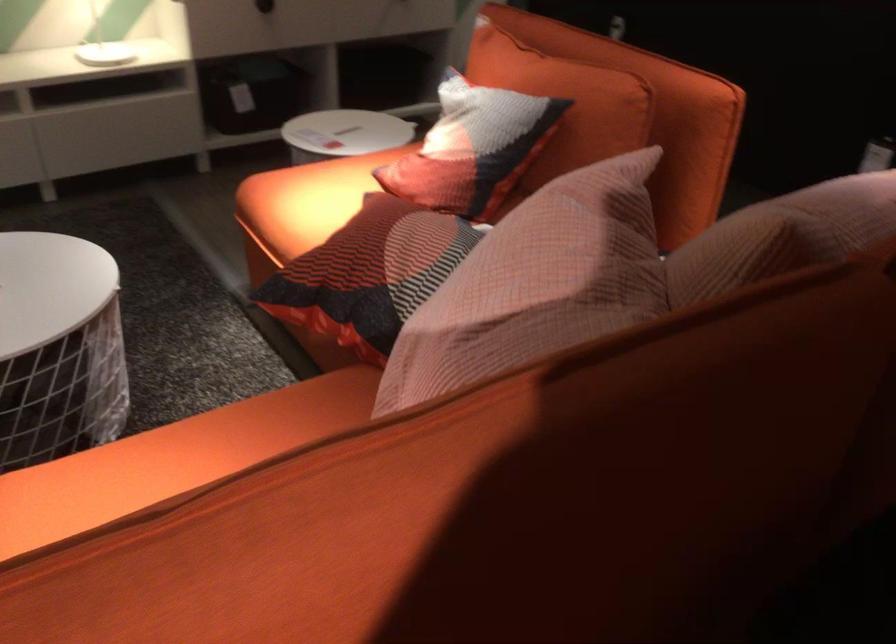
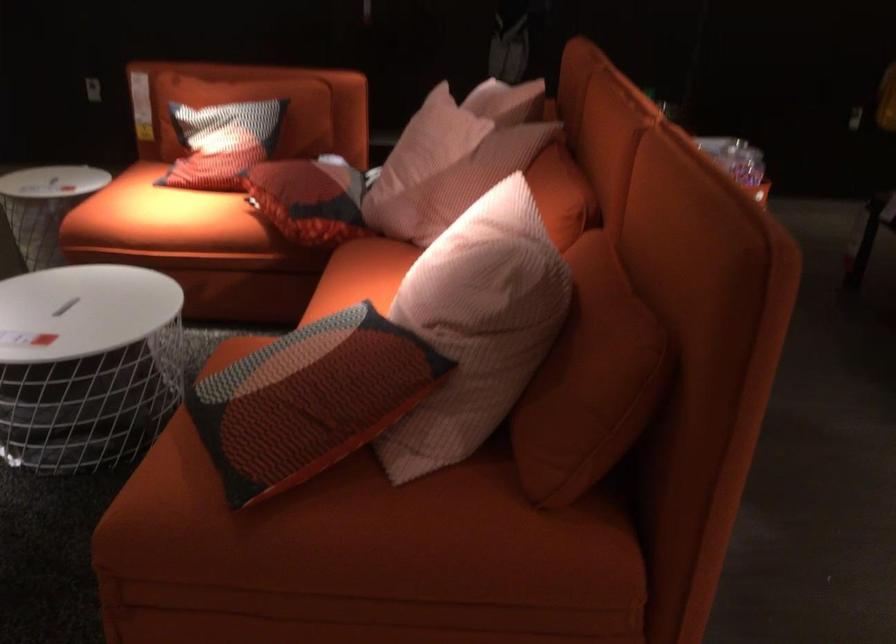
Where in the second image is the point corresponding to the point at 446,140 from the first image?

(222, 142)